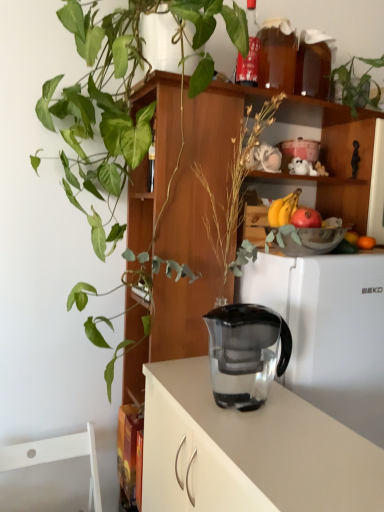
Identify the location of free space to the left of transparent plastic jug at center. (188, 393).